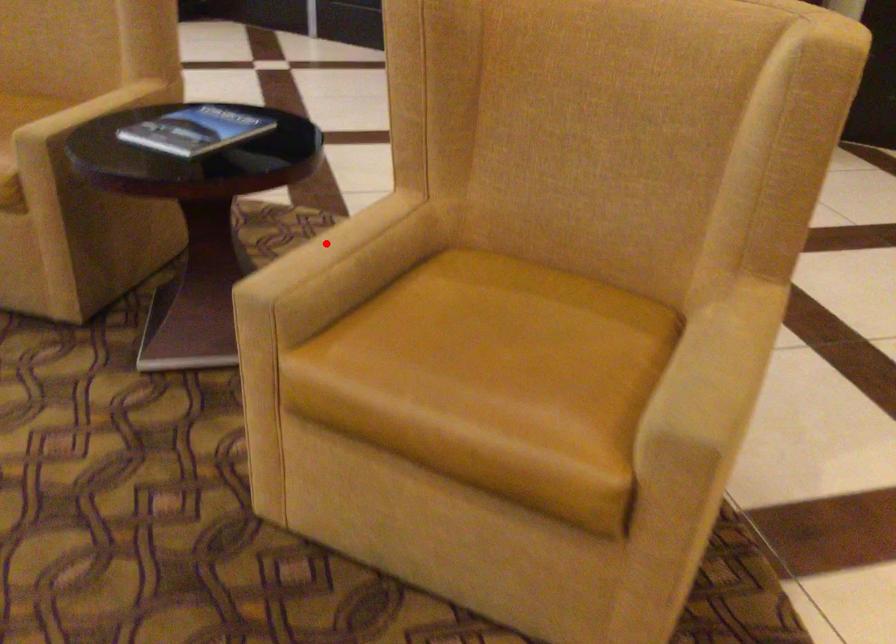
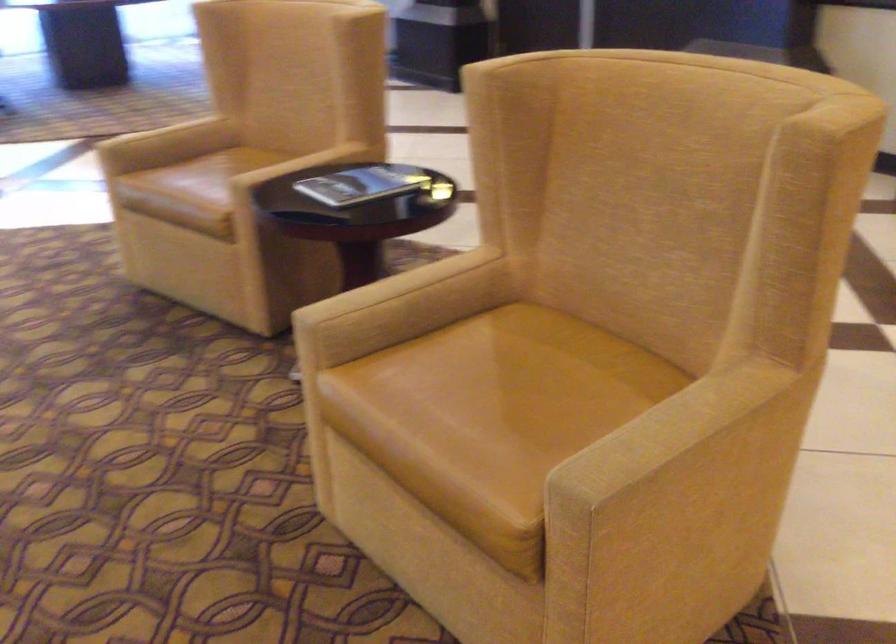
Question: A red point is marked in image1. In image2, is the corresponding 3D point closer to the camera or farther? Reply with the corresponding letter.

Choices:
 (A) The corresponding 3D point is closer.
 (B) The corresponding 3D point is farther.

Answer: (B)